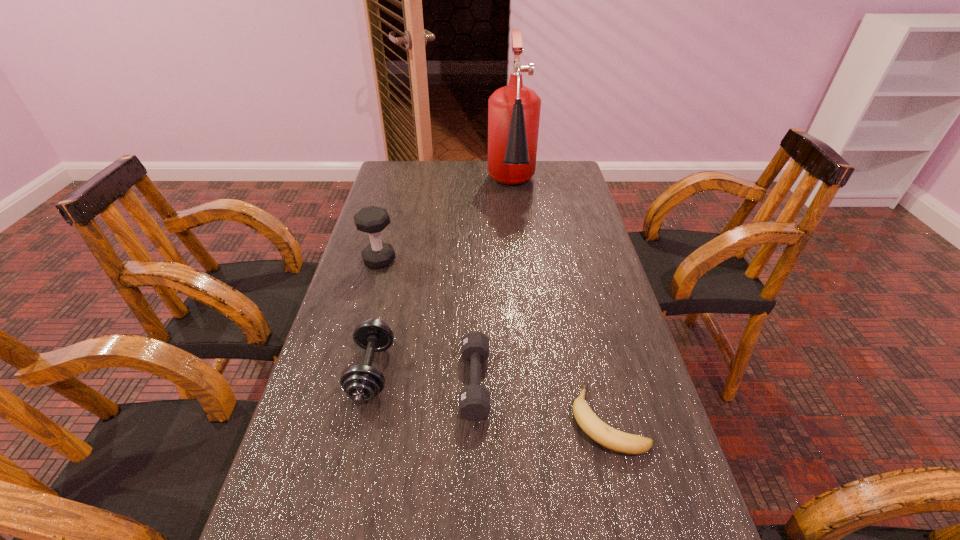
Where is `fire extinguisher`? fire extinguisher is located at coordinates coord(514,110).

The height and width of the screenshot is (540, 960). I want to click on the farthest object, so tap(514, 110).

Locate an element on the screen. the farthest dumbbell is located at coordinates (373, 219).

At what (x,y) coordinates should I click in order to perform the action: click on the fourth shortest object. Please return your answer as a coordinate pair (x, y). Looking at the image, I should click on (373, 219).

Find the location of `the third tallest object`. the third tallest object is located at coordinates [x=361, y=383].

Identify the location of the fourth tallest object. (474, 400).

Where is `the shortest dumbbell`? The image size is (960, 540). the shortest dumbbell is located at coordinates (474, 400).

I want to click on banana, so click(x=594, y=427).

Identify the location of vacant region located 0.080m with the nozzle aimed from the farthest object. The width and height of the screenshot is (960, 540). (516, 226).

Image resolution: width=960 pixels, height=540 pixels. Identify the location of free space located on the right of the fourth nearest object. (458, 260).